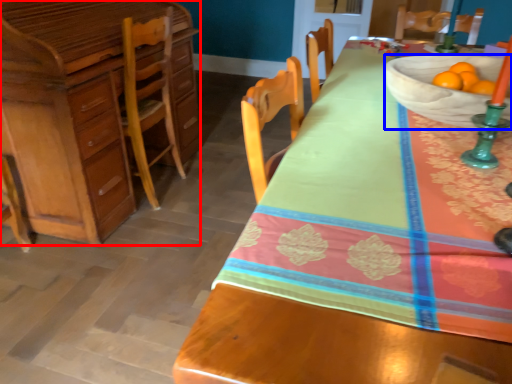
Question: Which point is further to the camera, cabinetry (highlighted by a red box) or bowl (highlighted by a blue box)?

Choices:
 (A) cabinetry
 (B) bowl

Answer: (A)